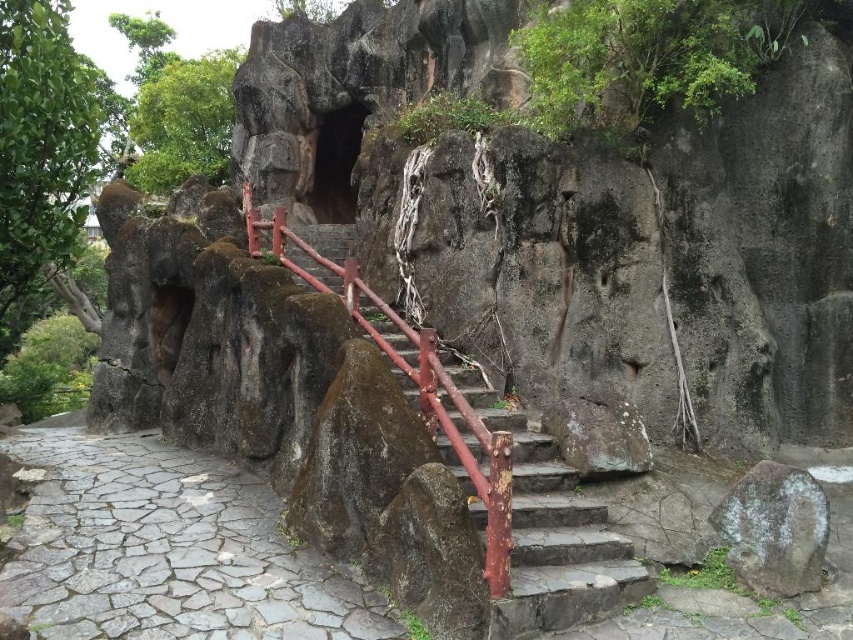
Question: Is gray stone path at lower left to the right of gray rough rock at lower right from the viewer's perspective?

Choices:
 (A) no
 (B) yes

Answer: (A)

Question: Is rusty metal stairs at center bigger than gray rough rock at lower right?

Choices:
 (A) yes
 (B) no

Answer: (A)

Question: Estimate the real-world distances between objects in this image. Which object is farther from the gray rough rock at lower right?

Choices:
 (A) gray stone path at lower left
 (B) rusty metal stairs at center

Answer: (A)

Question: Is gray stone path at lower left behind rusty metal stairs at center?

Choices:
 (A) yes
 (B) no

Answer: (B)

Question: Which point is farther to the camera?

Choices:
 (A) (761, 518)
 (B) (45, 429)

Answer: (B)

Question: Which object is farther from the camera taking this photo?

Choices:
 (A) gray stone path at lower left
 (B) rusty metal stairs at center

Answer: (B)